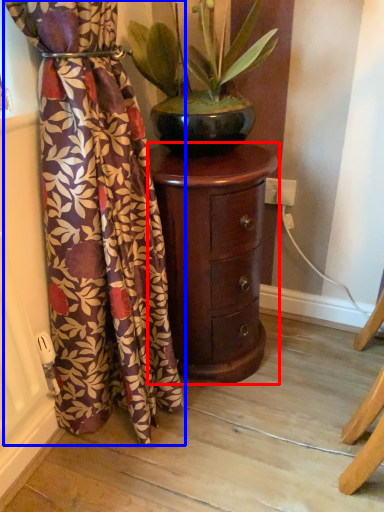
Question: Among these objects, which one is nearest to the camera, furniture (highlighted by a red box) or curtain (highlighted by a blue box)?

Choices:
 (A) furniture
 (B) curtain

Answer: (B)